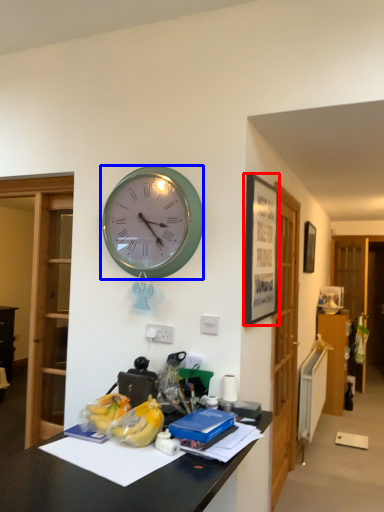
Question: Which of the following is the closest to the observer, picture frame (highlighted by a red box) or wall clock (highlighted by a blue box)?

Choices:
 (A) picture frame
 (B) wall clock

Answer: (A)